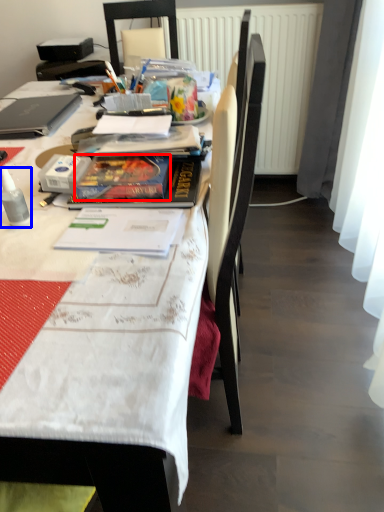
Question: Which point is further to the camera, paperback book (highlighted by a red box) or bottle (highlighted by a blue box)?

Choices:
 (A) paperback book
 (B) bottle

Answer: (A)